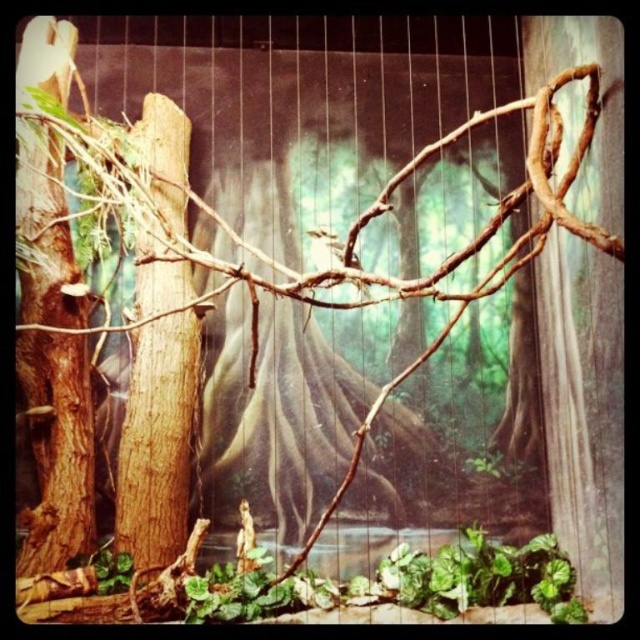
Question: Is brown rough tree trunk at left in front of brown textured branch at center?

Choices:
 (A) yes
 (B) no

Answer: (A)

Question: Which of the following is the farthest from the observer?

Choices:
 (A) brown textured branch at center
 (B) brown rough tree trunk at left

Answer: (A)

Question: Is brown rough tree trunk at left wider than brown textured branch at center?

Choices:
 (A) yes
 (B) no

Answer: (A)

Question: Does brown rough tree trunk at left appear on the right side of brown textured branch at center?

Choices:
 (A) yes
 (B) no

Answer: (B)